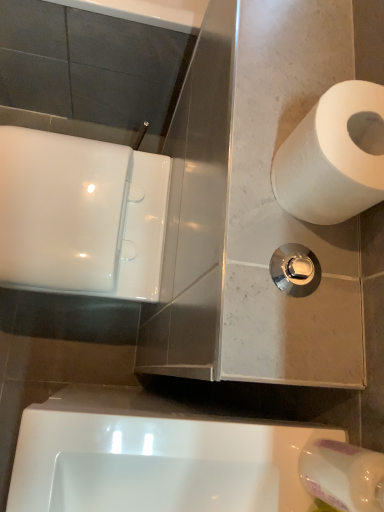
Where is `vacant area to the right of polished chrome flush handle at center-right`? vacant area to the right of polished chrome flush handle at center-right is located at coordinates (342, 328).